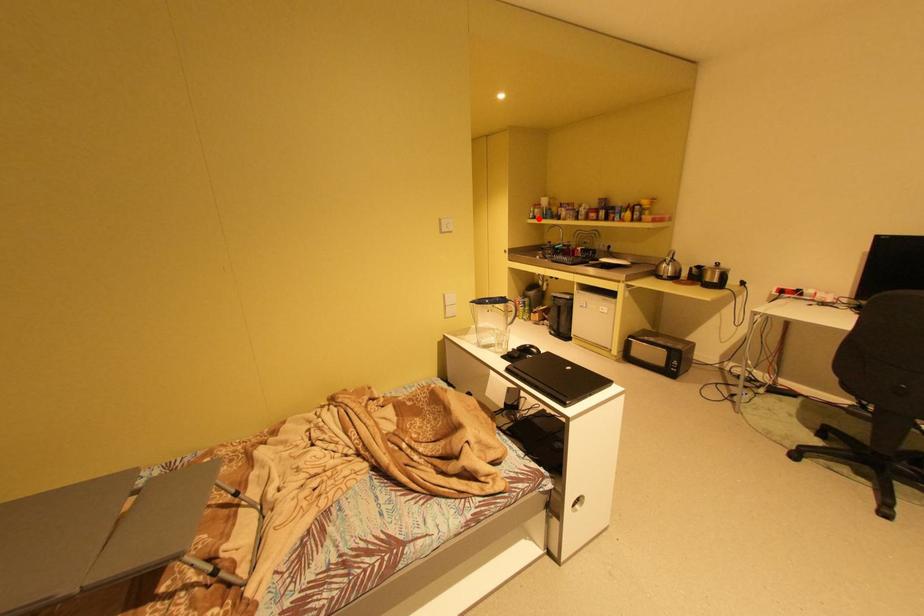
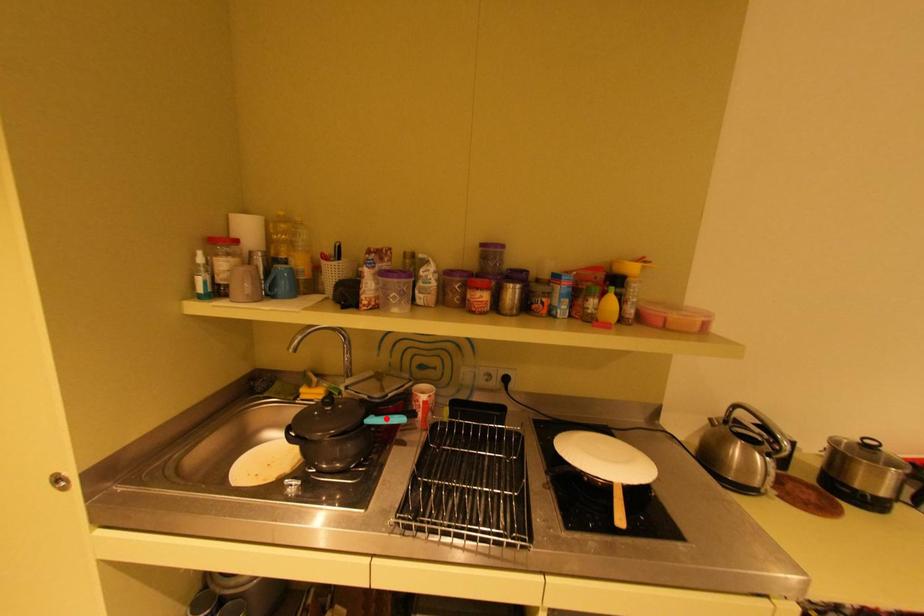
I am providing you with two images of the same scene from different viewpoints. A red point is marked on the first image and another point is marked on the second image. Are the points marked in image1 and image2 representing the same 3D position?

No